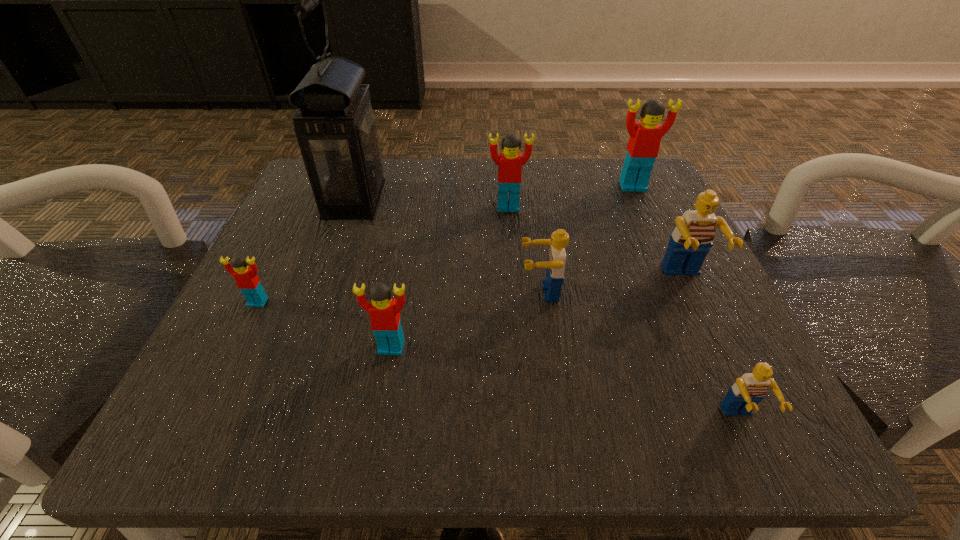
Where is `empty space between the second smallest red Lego and the nearest object`? Image resolution: width=960 pixels, height=540 pixels. empty space between the second smallest red Lego and the nearest object is located at coordinates pos(565,383).

Where is `vacant area that lies between the biggest blue Lego and the nearest blue Lego`? vacant area that lies between the biggest blue Lego and the nearest blue Lego is located at coordinates (712, 349).

The image size is (960, 540). What are the coordinates of `vacant space in between the third nearest red Lego and the tallest Lego` in the screenshot? It's located at (570, 197).

You are a GUI agent. You are given a task and a screenshot of the screen. Output one action in this format:
    pyautogui.click(x=<x>, y=<y>)
    Task: Click on the free space between the nearest red Lego and the leftmost blue Lego
    This screenshot has height=540, width=960.
    Given the screenshot: What is the action you would take?
    pyautogui.click(x=466, y=319)

The height and width of the screenshot is (540, 960). In order to click on free space between the nearest blue Lego and the second smallest blue Lego in this screenshot , I will do `click(640, 355)`.

The image size is (960, 540). I want to click on empty space between the seventh object from right to left and the biggest blue Lego, so click(x=519, y=239).

Identify which object is the fifth nearest to the smallest blue Lego. Please provide its 2D coordinates. Your answer should be formatted as a tuple, i.e. [(x, y)], where the tuple contains the x and y coordinates of a point satisfying the conditions above.

[(645, 136)]

Identify which object is the nearest to the sixth farthest Lego. Please provide its 2D coordinates. Your answer should be formatted as a tuple, i.e. [(x, y)], where the tuple contains the x and y coordinates of a point satisfying the conditions above.

[(555, 264)]

The image size is (960, 540). In order to click on Lego that is the third closest to the smallest red Lego in this screenshot , I will do `click(510, 162)`.

Identify which Lego is the fourth closest to the leftmost red Lego. Please provide its 2D coordinates. Your answer should be formatted as a tuple, i.e. [(x, y)], where the tuple contains the x and y coordinates of a point satisfying the conditions above.

[(691, 240)]